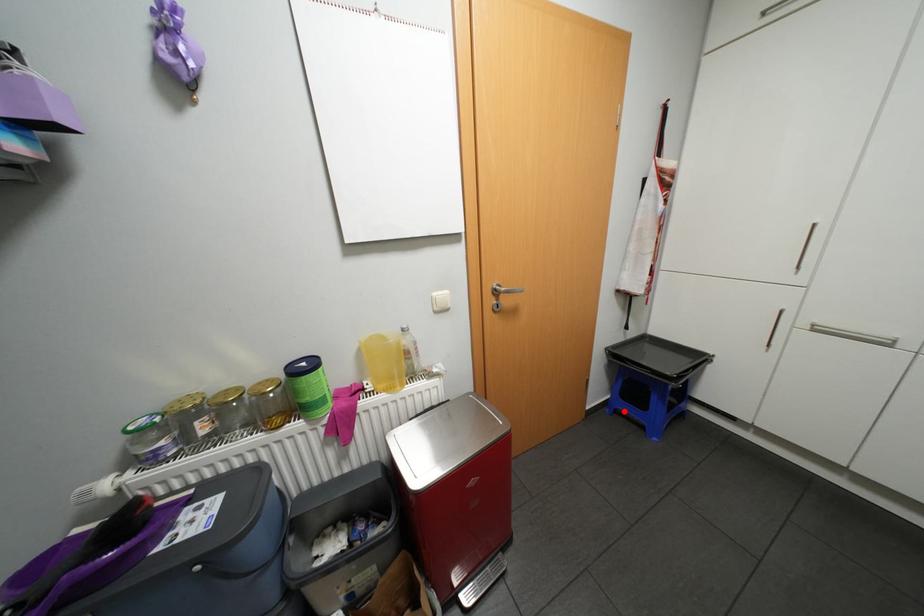
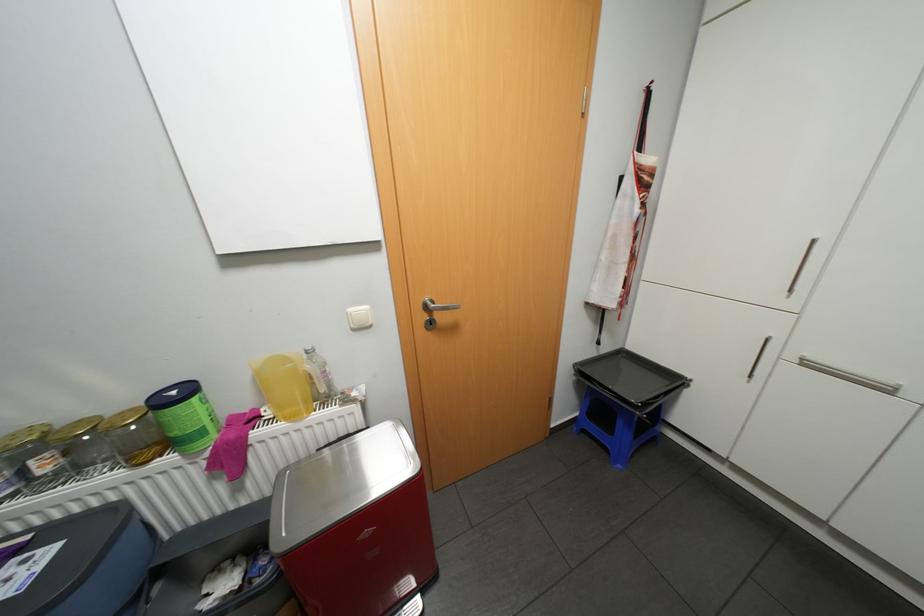
In the second image, find the point that corresponds to the highlighted location in the first image.

(591, 431)